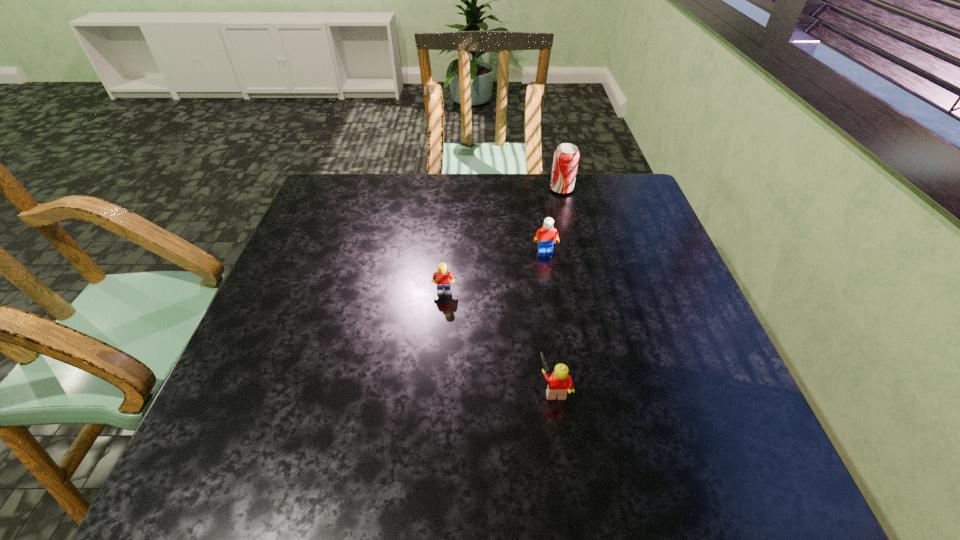
Locate which object is the third closest to the farthest Lego. Please provide its 2D coordinates. Your answer should be formatted as a tuple, i.e. [(x, y)], where the tuple contains the x and y coordinates of a point satisfying the conditions above.

[(559, 382)]

This screenshot has width=960, height=540. What are the coordinates of `object identified as the second closest to the third nearest object` in the screenshot? It's located at (566, 156).

Locate which Lego is the closest to the nearest object. Please provide its 2D coordinates. Your answer should be formatted as a tuple, i.e. [(x, y)], where the tuple contains the x and y coordinates of a point satisfying the conditions above.

[(443, 278)]

The width and height of the screenshot is (960, 540). Find the location of `the closest Lego relative to the third nearest object`. the closest Lego relative to the third nearest object is located at coordinates tap(443, 278).

I want to click on vacant area that satisfies the following two spatial constraints: 1. on the logo side of the rightmost object; 2. on the front-facing side of the leftmost Lego, so click(x=587, y=292).

Identify the location of vacant space that satisfies the following two spatial constraints: 1. on the logo side of the tallest object; 2. on the front-facing side of the third farthest object. Image resolution: width=960 pixels, height=540 pixels. (587, 292).

Where is `free location that satisfies the following two spatial constraints: 1. on the face of the third nearest object; 2. in front of the nearest object with the accessory visible`? free location that satisfies the following two spatial constraints: 1. on the face of the third nearest object; 2. in front of the nearest object with the accessory visible is located at coordinates (567, 388).

The width and height of the screenshot is (960, 540). In order to click on vacant position in the image that satisfies the following two spatial constraints: 1. on the logo side of the soda can; 2. on the front-facing side of the second nearest Lego in this screenshot , I will do `click(587, 292)`.